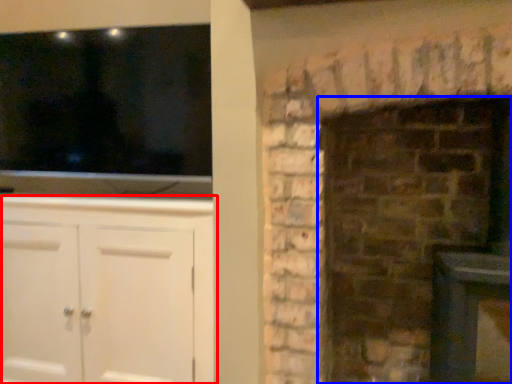
Question: Which object appears closest to the camera in this image, cabinetry (highlighted by a red box) or fireplace (highlighted by a blue box)?

Choices:
 (A) cabinetry
 (B) fireplace

Answer: (B)